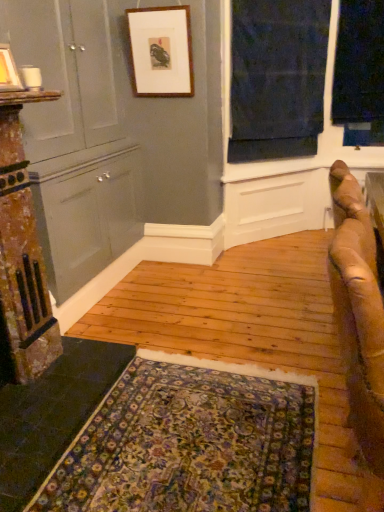
Where is `blank space situated above floral carpet at lower center (from a real-world perspective)`? blank space situated above floral carpet at lower center (from a real-world perspective) is located at coordinates (194, 430).